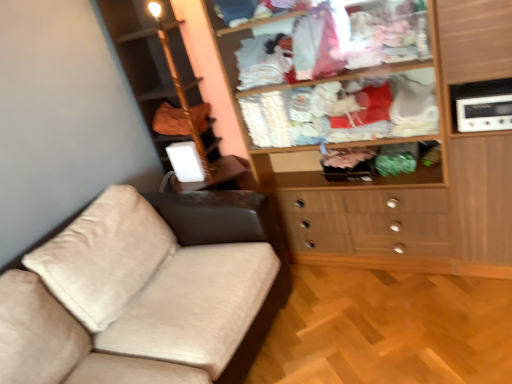
You are a GUI agent. You are given a task and a screenshot of the screen. Output one action in this format:
    pyautogui.click(x=<x>, y=<y>)
    Task: Click on the brown fabric bag at upper left
    This screenshot has height=384, width=512.
    Given the screenshot: What is the action you would take?
    pyautogui.click(x=170, y=121)

What do you see at coordinates (416, 171) in the screenshot? I see `wooden wardrobe at upper right` at bounding box center [416, 171].

Locate an element on the screen. white plastic radio at upper right is located at coordinates (482, 105).

Is white plastic radio at upper right wider than brown fabric bag at upper left?

Yes.

Does white plastic radio at upper right have a larger size compared to brown fabric bag at upper left?

No.

From the image's perspective, is white plastic radio at upper right over brown fabric bag at upper left?

Actually, white plastic radio at upper right appears below brown fabric bag at upper left in the image.

From the picture: From the image's perspective, between wooden wardrobe at upper right and brown fabric bag at upper left, who is located below?

wooden wardrobe at upper right is shown below in the image.

Is wooden wardrobe at upper right inside the boundaries of brown fabric bag at upper left, or outside?

wooden wardrobe at upper right is not enclosed by brown fabric bag at upper left.

Does point (447, 153) come farther from viewer compared to point (179, 121)?

That is False.

From a real-world perspective, which object rests below the other?

wooden wardrobe at upper right.

Is white plastic radio at upper right positioned with its back to wooden wardrobe at upper right?

white plastic radio at upper right does not have its back to wooden wardrobe at upper right.

Is white plastic radio at upper right taller or shorter than wooden wardrobe at upper right?

Clearly, white plastic radio at upper right is shorter compared to wooden wardrobe at upper right.

Would you say wooden wardrobe at upper right is part of white plastic radio at upper right's contents?

No.

Considering the relative sizes of brown fabric bag at upper left and wooden wardrobe at upper right in the image provided, is brown fabric bag at upper left wider than wooden wardrobe at upper right?

Incorrect, the width of brown fabric bag at upper left does not surpass that of wooden wardrobe at upper right.

Considering the positions of objects brown fabric bag at upper left and wooden wardrobe at upper right in the image provided, who is behind, brown fabric bag at upper left or wooden wardrobe at upper right?

brown fabric bag at upper left is behind.

Is brown fabric bag at upper left touching wooden wardrobe at upper right?

brown fabric bag at upper left and wooden wardrobe at upper right are clearly separated.

Considering the sizes of objects brown fabric bag at upper left and wooden wardrobe at upper right in the image provided, who is shorter, brown fabric bag at upper left or wooden wardrobe at upper right?

With less height is brown fabric bag at upper left.

Is brown fabric bag at upper left outside of white plastic radio at upper right?

Yes, brown fabric bag at upper left is outside of white plastic radio at upper right.

Looking at this image, from a real-world perspective, between brown fabric bag at upper left and white plastic radio at upper right, who is vertically higher?

brown fabric bag at upper left.

Is brown fabric bag at upper left not close to white plastic radio at upper right?

That's right, there is a large distance between brown fabric bag at upper left and white plastic radio at upper right.

Considering the positions of points (170, 132) and (462, 115), is point (170, 132) closer to camera compared to point (462, 115)?

No, (170, 132) is further to viewer.

Is wooden wardrobe at upper right far from white plastic radio at upper right?

They are positioned close to each other.

Looking at this image, from the image's perspective, relative to white plastic radio at upper right, is wooden wardrobe at upper right above or below?

Clearly, from the image's perspective, wooden wardrobe at upper right is below white plastic radio at upper right.

Between wooden wardrobe at upper right and white plastic radio at upper right, which one is positioned in front?

wooden wardrobe at upper right is closer to the camera.

Is wooden wardrobe at upper right looking in the opposite direction of white plastic radio at upper right?

No, white plastic radio at upper right is not at the back of wooden wardrobe at upper right.

This screenshot has height=384, width=512. What are the coordinates of `clothing above the white plastic radio at upper right (from the image's perspective)` in the screenshot? It's located at (170, 121).

Locate an element on the screen. Image resolution: width=512 pixels, height=384 pixels. cupboard in front of the brown fabric bag at upper left is located at coordinates (416, 171).

Looking at the image, which one is located closer to wooden wardrobe at upper right, white plastic radio at upper right or brown fabric bag at upper left?

white plastic radio at upper right is closer to wooden wardrobe at upper right.

When comparing their distances from wooden wardrobe at upper right, does brown fabric bag at upper left or white plastic radio at upper right seem further?

Based on the image, brown fabric bag at upper left appears to be further to wooden wardrobe at upper right.

From the image, which object appears to be farther from white plastic radio at upper right, brown fabric bag at upper left or wooden wardrobe at upper right?

Among the two, brown fabric bag at upper left is located further to white plastic radio at upper right.

From the image, which object appears to be farther from brown fabric bag at upper left, wooden wardrobe at upper right or white plastic radio at upper right?

The object further to brown fabric bag at upper left is white plastic radio at upper right.

Estimate the real-world distances between objects in this image. Which object is closer to white plastic radio at upper right, wooden wardrobe at upper right or brown fabric bag at upper left?

The object closer to white plastic radio at upper right is wooden wardrobe at upper right.

Estimate the real-world distances between objects in this image. Which object is closer to brown fabric bag at upper left, white plastic radio at upper right or wooden wardrobe at upper right?

wooden wardrobe at upper right is closer to brown fabric bag at upper left.

Find the location of a particular element. cupboard between brown fabric bag at upper left and white plastic radio at upper right in the horizontal direction is located at coordinates (416, 171).